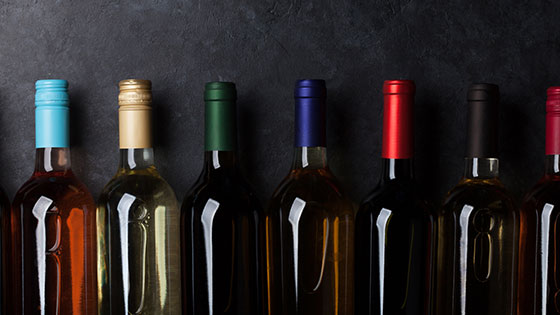
Where is `wine bottle`? This screenshot has height=315, width=560. wine bottle is located at coordinates (45, 213), (307, 238), (232, 246), (422, 241), (496, 240), (541, 229).